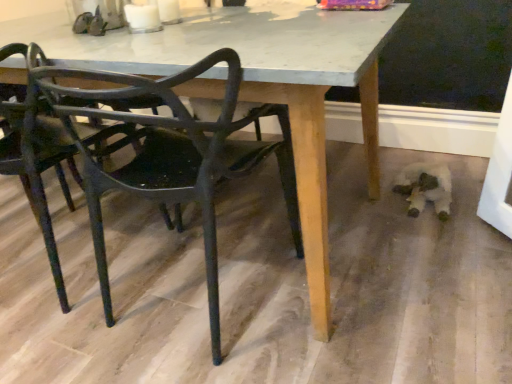
Question: Does metallic black chair at left, which is counted as the second chair, starting from the right, lie behind matte black chair at lower left, which is the first chair from right to left?

Choices:
 (A) no
 (B) yes

Answer: (B)

Question: Can you confirm if metallic black chair at left, marked as the 1th chair in a left-to-right arrangement, is taller than matte black chair at lower left, marked as the 2th chair in a left-to-right arrangement?

Choices:
 (A) no
 (B) yes

Answer: (A)

Question: Is metallic black chair at left, marked as the 1th chair in a left-to-right arrangement, directly adjacent to matte black chair at lower left, which is the first chair from right to left?

Choices:
 (A) no
 (B) yes

Answer: (A)

Question: Does metallic black chair at left, marked as the 1th chair in a left-to-right arrangement, have a lesser height compared to matte black chair at lower left, which is the first chair from right to left?

Choices:
 (A) yes
 (B) no

Answer: (A)

Question: Is metallic black chair at left, marked as the 1th chair in a left-to-right arrangement, at the right side of matte black chair at lower left, which is the first chair from right to left?

Choices:
 (A) no
 (B) yes

Answer: (A)

Question: From the image's perspective, is metallic black chair at left, marked as the 1th chair in a left-to-right arrangement, located above matte black chair at lower left, which is the first chair from right to left?

Choices:
 (A) no
 (B) yes

Answer: (B)

Question: Is matte black chair at lower left, marked as the 2th chair in a left-to-right arrangement, thinner than metallic black chair at left, which is counted as the second chair, starting from the right?

Choices:
 (A) no
 (B) yes

Answer: (B)

Question: Does matte black chair at lower left, which is the first chair from right to left, have a smaller size compared to metallic black chair at left, which is counted as the second chair, starting from the right?

Choices:
 (A) no
 (B) yes

Answer: (B)

Question: Is matte black chair at lower left, which is the first chair from right to left, in front of metallic black chair at left, which is counted as the second chair, starting from the right?

Choices:
 (A) yes
 (B) no

Answer: (A)

Question: Is the depth of matte black chair at lower left, which is the first chair from right to left, greater than that of metallic black chair at left, marked as the 1th chair in a left-to-right arrangement?

Choices:
 (A) no
 (B) yes

Answer: (A)

Question: Is matte black chair at lower left, marked as the 2th chair in a left-to-right arrangement, outside of metallic black chair at left, marked as the 1th chair in a left-to-right arrangement?

Choices:
 (A) no
 (B) yes

Answer: (B)

Question: Is matte black chair at lower left, which is the first chair from right to left, taller than metallic black chair at left, which is counted as the second chair, starting from the right?

Choices:
 (A) no
 (B) yes

Answer: (B)

Question: From a real-world perspective, is matte black chair at lower left, which is the first chair from right to left, positioned above or below metallic black chair at left, marked as the 1th chair in a left-to-right arrangement?

Choices:
 (A) below
 (B) above

Answer: (A)